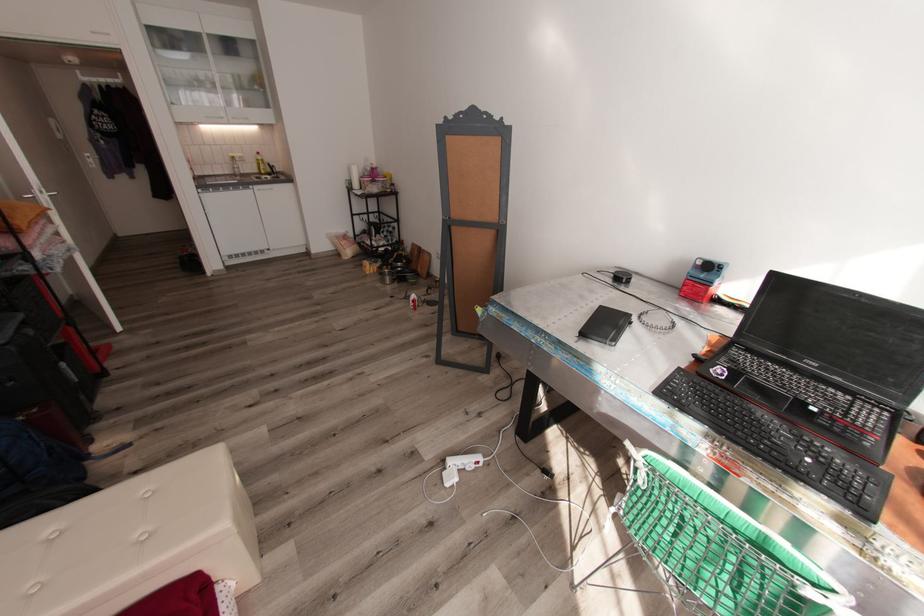
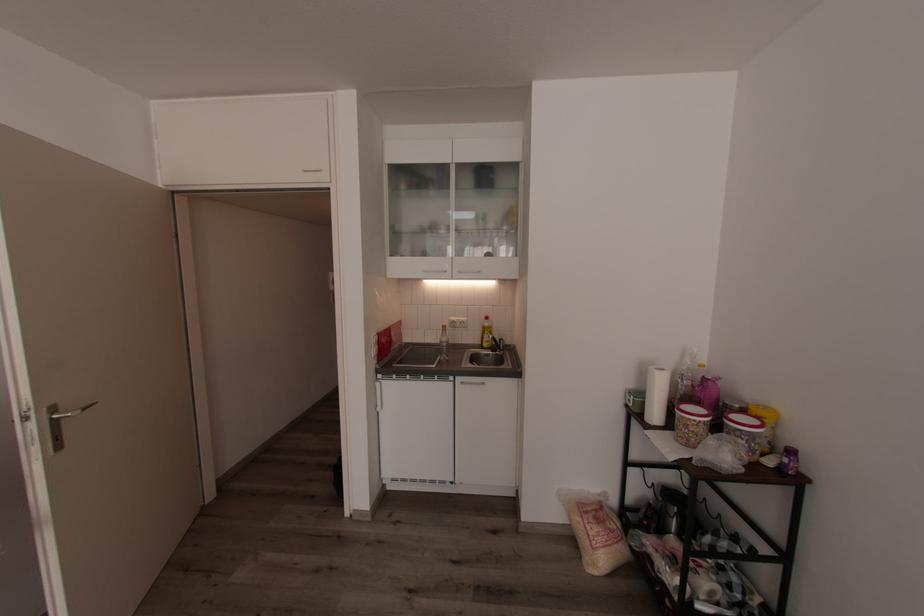
In the second image, find the point that corresponds to point (256, 187) in the first image.

(456, 378)